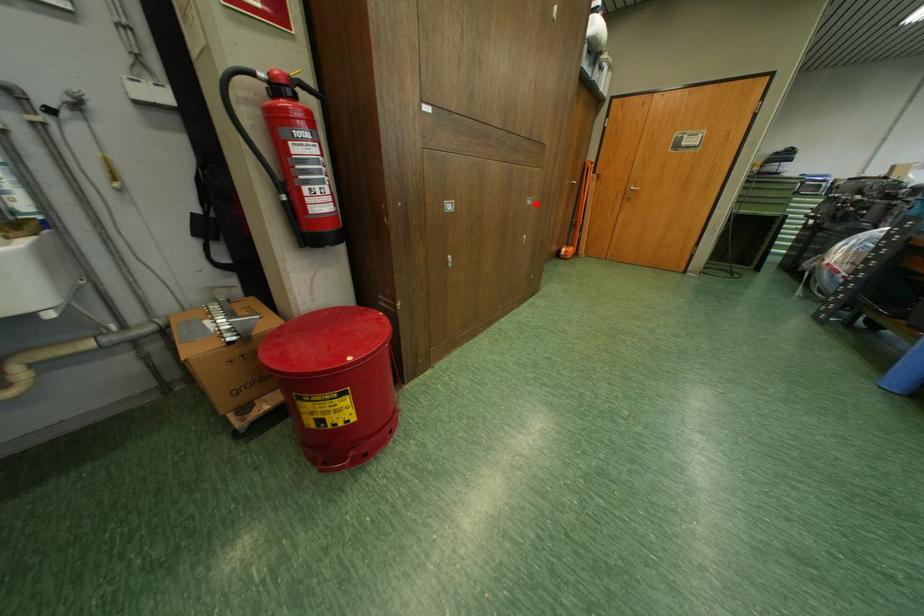
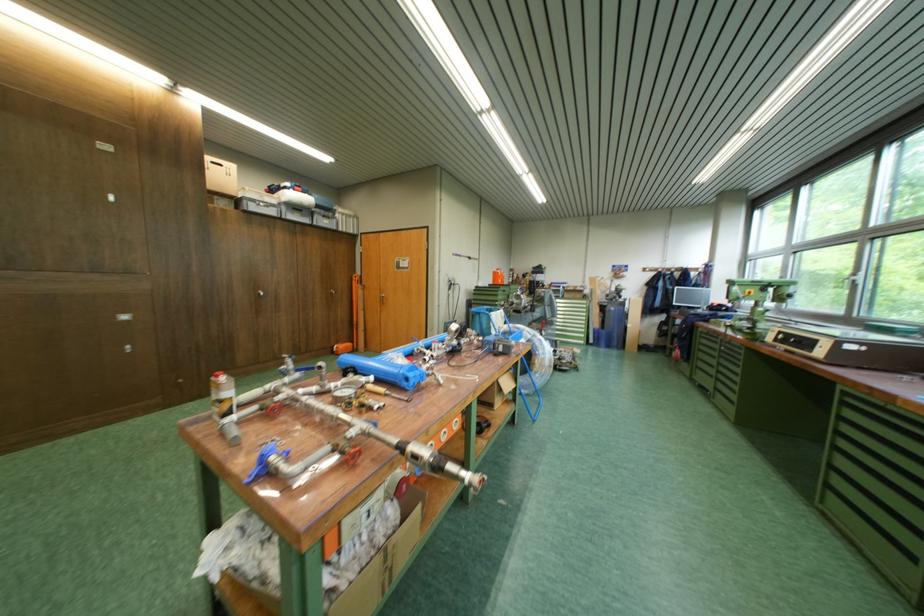
Question: I am providing you with two images of the same scene from different viewpoints. Given a red point in image1, look at the same physical point in image2. Is it:

Choices:
 (A) Closer to the viewpoint
 (B) Farther from the viewpoint

Answer: (B)